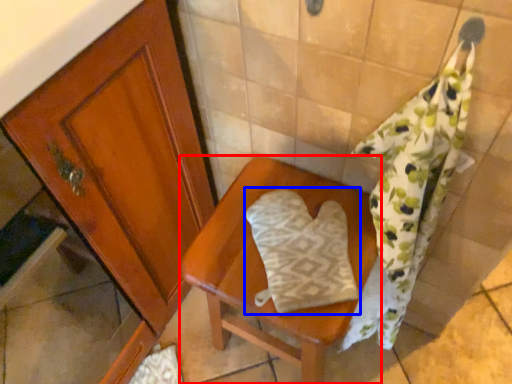
Question: Which object is closer to the camera taking this photo, furniture (highlighted by a red box) or throw pillow (highlighted by a blue box)?

Choices:
 (A) furniture
 (B) throw pillow

Answer: (A)